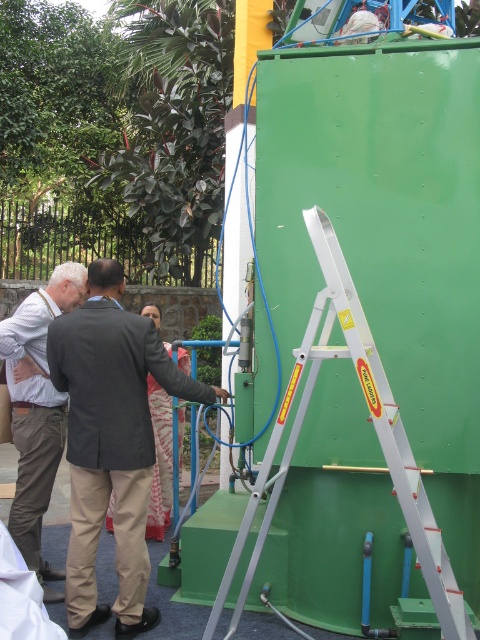
Does dark gray suit at center come behind light brown fabric shirt at left?

That is False.

How far apart are dark gray suit at center and light brown fabric shirt at left?

dark gray suit at center is 20.32 inches away from light brown fabric shirt at left.

Between point (134, 552) and point (12, 403), which one is positioned in front?

Point (134, 552) is more forward.

Locate an element on the screen. This screenshot has height=640, width=480. dark gray suit at center is located at coordinates (110, 442).

Which is more to the left, dark gray suit at center or silver/aluminum step ladder at right?

dark gray suit at center is more to the left.

Is the position of dark gray suit at center less distant than that of silver/aluminum step ladder at right?

No, dark gray suit at center is behind silver/aluminum step ladder at right.

Describe the element at coordinates (110, 442) in the screenshot. The image size is (480, 640). I see `dark gray suit at center` at that location.

Find the location of a particular element. This screenshot has height=640, width=480. dark gray suit at center is located at coordinates (110, 442).

Is silver/aluminum step ladder at right thinner than light brown fabric shirt at left?

No.

Can you confirm if silver/aluminum step ladder at right is shorter than light brown fabric shirt at left?

No.

Does point (351, 312) lie behind point (37, 332)?

No, it is not.

I want to click on silver/aluminum step ladder at right, so click(373, 428).